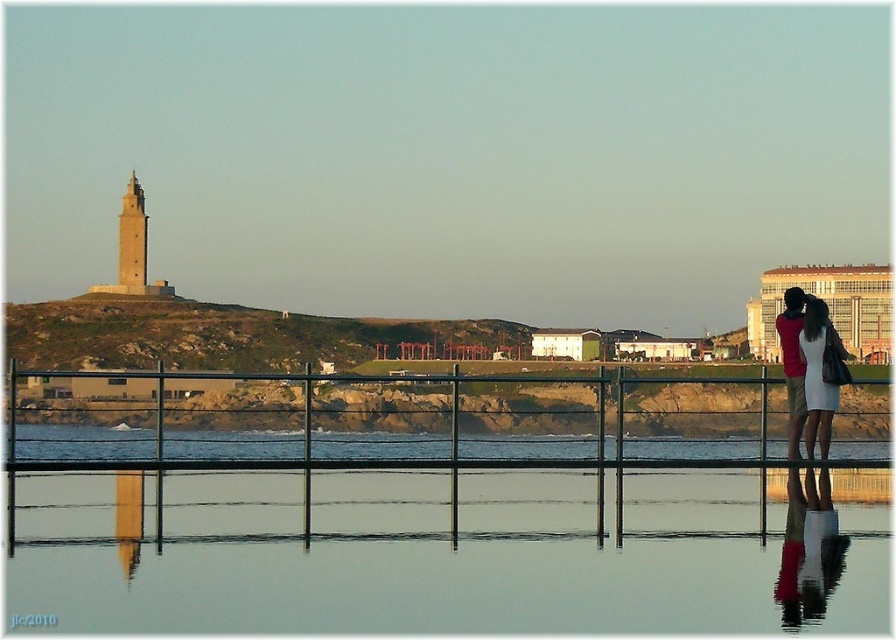
Who is positioned more to the right, red fabric shirt at right or brown stone tower at left?

red fabric shirt at right

Is red fabric shirt at right positioned behind brown stone tower at left?

No, red fabric shirt at right is closer to the viewer.

Who is more forward, (800, 381) or (139, 220)?

Point (800, 381) is in front.

You are a GUI agent. You are given a task and a screenshot of the screen. Output one action in this format:
    pyautogui.click(x=<x>, y=<y>)
    Task: Click on the red fabric shirt at right
    The width and height of the screenshot is (896, 640).
    Given the screenshot: What is the action you would take?
    pyautogui.click(x=791, y=364)

Between metal fence at center and beige stone tower at left, which one has less height?

metal fence at center

Who is more distant from viewer, (276, 426) or (136, 234)?

The point (136, 234) is behind.

Is point (285, 465) less distant than point (127, 195)?

Yes, it is.

Find the location of a particular element. The width and height of the screenshot is (896, 640). metal fence at center is located at coordinates (425, 438).

Which of these two, beige stone tower at left or red fabric shirt at right, stands shorter?

With less height is red fabric shirt at right.

Does point (125, 275) lie behind point (797, 337)?

Yes, point (125, 275) is farther from viewer.

Describe the element at coordinates (132, 248) in the screenshot. This screenshot has height=640, width=896. I see `beige stone tower at left` at that location.

At what (x,y) coordinates should I click in order to perform the action: click on beige stone tower at left. Please return your answer as a coordinate pair (x, y). The height and width of the screenshot is (640, 896). Looking at the image, I should click on (132, 248).